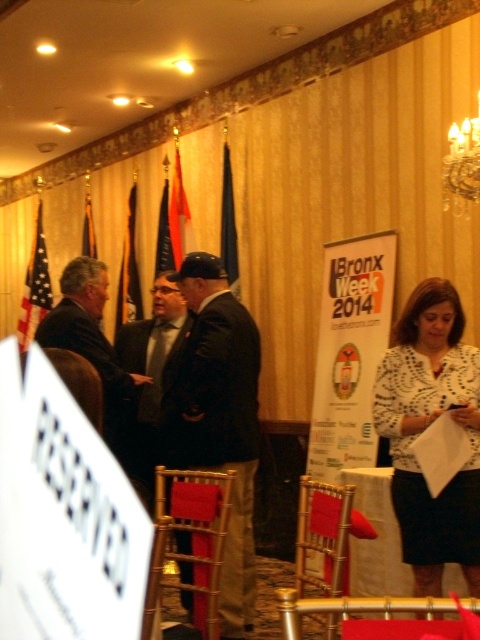
Question: Does gold wood chair at center have a smaller size compared to red fabric flag at upper center?

Choices:
 (A) yes
 (B) no

Answer: (B)

Question: Does metallic gold chair at center appear on the right side of red fabric flag at upper center?

Choices:
 (A) yes
 (B) no

Answer: (A)

Question: Which point appears farthest from the camera in this image?

Choices:
 (A) (x=41, y=288)
 (B) (x=122, y=257)

Answer: (A)

Question: Which point appears closest to the camera in this image?

Choices:
 (A) pyautogui.click(x=20, y=348)
 (B) pyautogui.click(x=192, y=243)
 (C) pyautogui.click(x=335, y=506)
 (D) pyautogui.click(x=91, y=243)

Answer: (A)

Question: Is american flag at left positioned before red fabric flag at upper center?

Choices:
 (A) no
 (B) yes

Answer: (A)

Question: Among these points, which one is farthest from the camera?

Choices:
 (A) (88, 220)
 (B) (139, 304)
 (C) (204, 520)

Answer: (A)